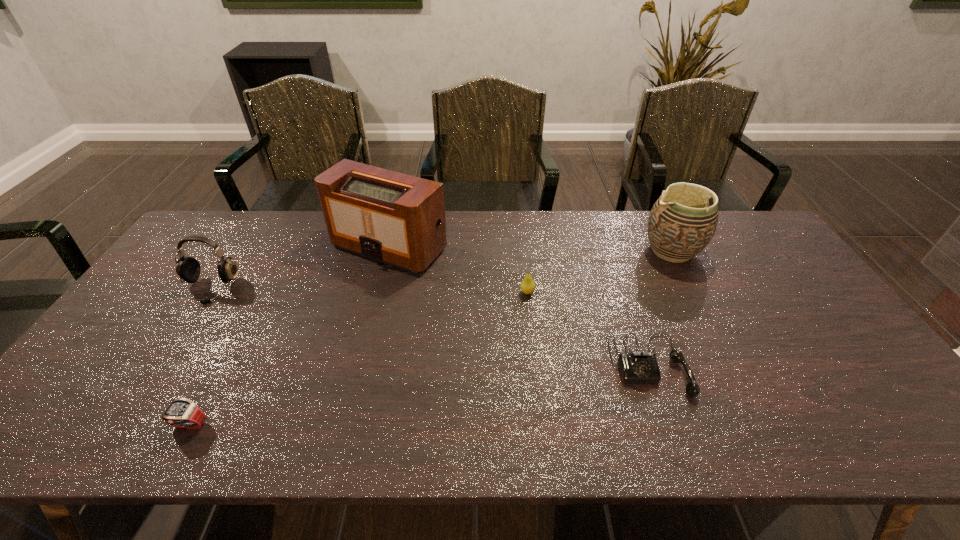
This screenshot has height=540, width=960. In order to click on the fourth object from right to left in this screenshot , I will do `click(394, 218)`.

The height and width of the screenshot is (540, 960). I want to click on the rightmost object, so click(x=681, y=224).

What are the coordinates of `the fourth shortest object` in the screenshot? It's located at (188, 268).

Image resolution: width=960 pixels, height=540 pixels. What are the coordinates of `the leftmost object` in the screenshot? It's located at (188, 268).

Locate an element on the screen. This screenshot has height=540, width=960. the fourth tallest object is located at coordinates (527, 286).

Where is `pear`? pear is located at coordinates (527, 286).

Locate an element on the screen. The height and width of the screenshot is (540, 960). the fifth farthest object is located at coordinates (636, 367).

Where is `telephone`? telephone is located at coordinates (636, 367).

Locate an element on the screen. the nearest object is located at coordinates (182, 413).

Image resolution: width=960 pixels, height=540 pixels. Find the location of `watch`. watch is located at coordinates (182, 413).